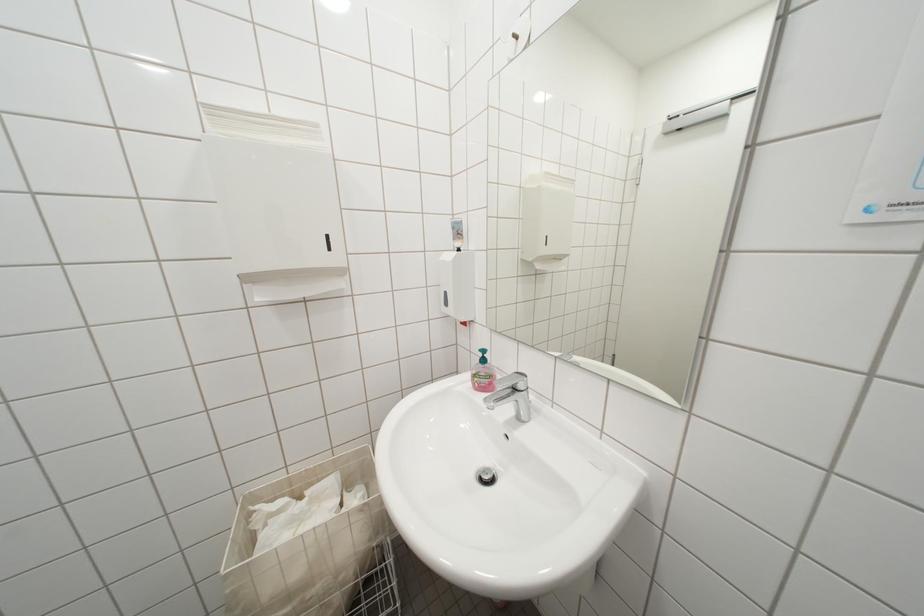
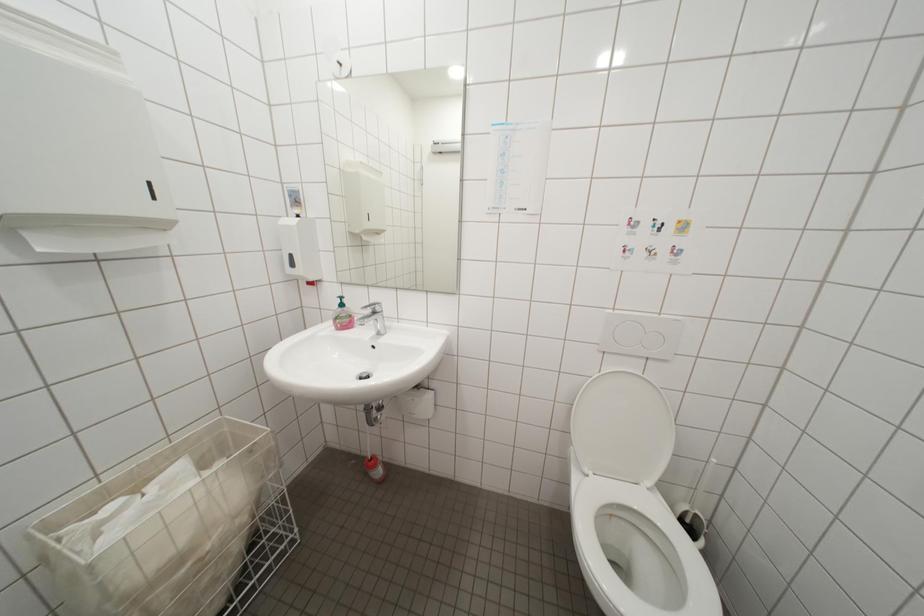
Question: How did the camera likely rotate?

Choices:
 (A) Left
 (B) Right
 (C) Up
 (D) Down

Answer: (B)